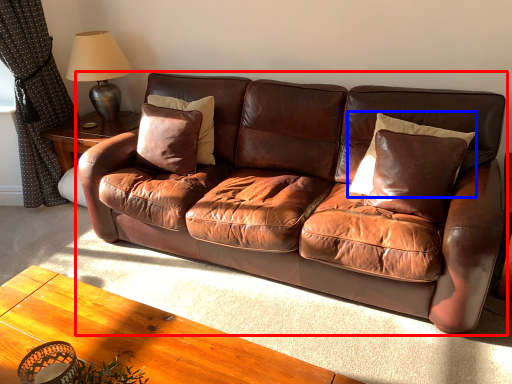
Question: Which of the following is the closest to the observer, studio couch (highlighted by a red box) or pillow (highlighted by a blue box)?

Choices:
 (A) studio couch
 (B) pillow

Answer: (A)